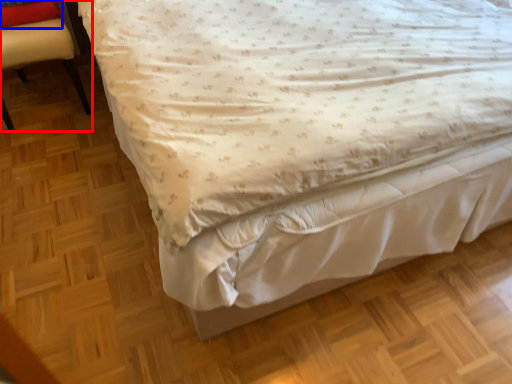
Question: Which point is further to the camera, chair (highlighted by a red box) or pillow (highlighted by a blue box)?

Choices:
 (A) chair
 (B) pillow

Answer: (B)